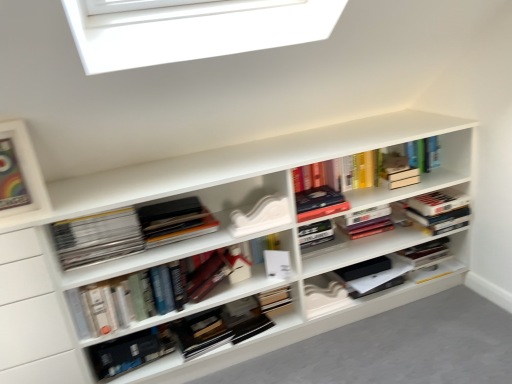
Question: From the image's perspective, is hardcover books at center, which is the 3th book in right-to-left order, located above hardcover book at center, arranged as the 5th book when viewed from the right?

Choices:
 (A) yes
 (B) no

Answer: (A)

Question: Is hardcover books at center, which is the 3th book in right-to-left order, further to the viewer compared to hardcover book at center, arranged as the 5th book when viewed from the right?

Choices:
 (A) no
 (B) yes

Answer: (A)

Question: Is hardcover books at center, which is the 3th book in right-to-left order, closer to the viewer compared to hardcover book at center, arranged as the 5th book when viewed from the right?

Choices:
 (A) no
 (B) yes

Answer: (B)

Question: Does hardcover books at center, which is the 3th book in right-to-left order, turn towards hardcover book at center, which is the second book from left to right?

Choices:
 (A) no
 (B) yes

Answer: (A)

Question: Is hardcover books at center, the 4th book from the left, taller than hardcover book at center, which is the second book from left to right?

Choices:
 (A) yes
 (B) no

Answer: (B)

Question: From the image's perspective, is matte wooden picture frame at upper left located above or below hardcover books at center, arranged as the sixth book when viewed from the left?

Choices:
 (A) above
 (B) below

Answer: (A)

Question: From their relative heights in the image, would you say matte wooden picture frame at upper left is taller or shorter than hardcover books at center, arranged as the sixth book when viewed from the left?

Choices:
 (A) tall
 (B) short

Answer: (A)

Question: Does point (16, 130) appear closer or farther from the camera than point (388, 211)?

Choices:
 (A) closer
 (B) farther

Answer: (A)

Question: Considering their positions, is matte wooden picture frame at upper left located in front of or behind hardcover books at center, acting as the first book starting from the right?

Choices:
 (A) behind
 (B) front

Answer: (B)

Question: Which is correct: hardcover books at center, the 4th book from the left, is inside hardcover book at center, which is the second book from left to right, or outside of it?

Choices:
 (A) outside
 (B) inside

Answer: (A)

Question: In terms of size, does hardcover books at center, the 4th book from the left, appear bigger or smaller than hardcover book at center, arranged as the 5th book when viewed from the right?

Choices:
 (A) big
 (B) small

Answer: (A)

Question: From a real-world perspective, is hardcover books at center, the 4th book from the left, above or below hardcover book at center, arranged as the 5th book when viewed from the right?

Choices:
 (A) below
 (B) above

Answer: (B)

Question: From the image's perspective, is hardcover books at center, which is the 3th book in right-to-left order, above or below hardcover book at center, arranged as the 5th book when viewed from the right?

Choices:
 (A) above
 (B) below

Answer: (A)

Question: From the image's perspective, relative to matte black books at left, the 6th book positioned from the right, is white matte paperback book at center, the first paperback book from the right, above or below?

Choices:
 (A) above
 (B) below

Answer: (B)

Question: From a real-world perspective, is white matte paperback book at center, the first paperback book from the right, above or below matte black books at left, which is the first book in left-to-right order?

Choices:
 (A) above
 (B) below

Answer: (B)